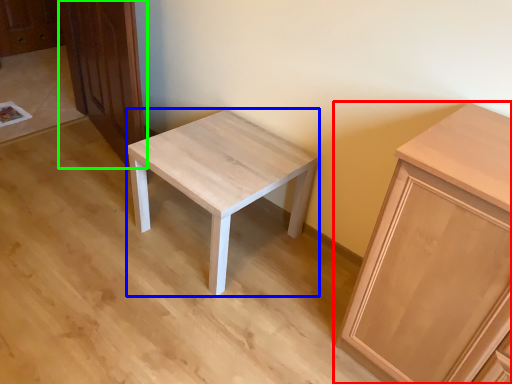
Question: Which object is positioned closest to cabinetry (highlighted by a red box)? Select from stool (highlighted by a blue box) and dresser (highlighted by a green box).

Choices:
 (A) stool
 (B) dresser

Answer: (A)